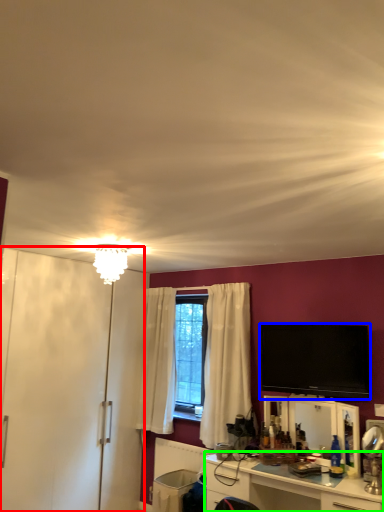
Question: Based on their relative distances, which object is nearer to armoire (highlighted by a red box)? Choose from television (highlighted by a blue box) and cabinetry (highlighted by a green box).

Choices:
 (A) television
 (B) cabinetry

Answer: (B)